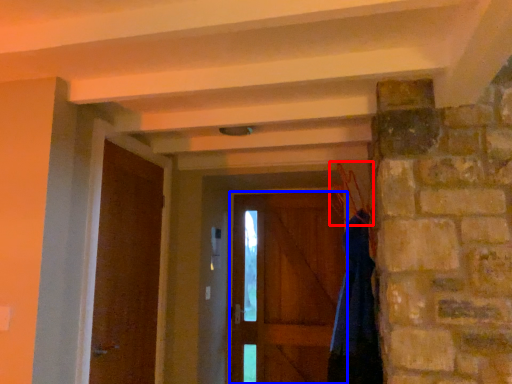
Question: Which object is further to the camera taking this photo, hanger (highlighted by a red box) or door (highlighted by a blue box)?

Choices:
 (A) hanger
 (B) door

Answer: (B)